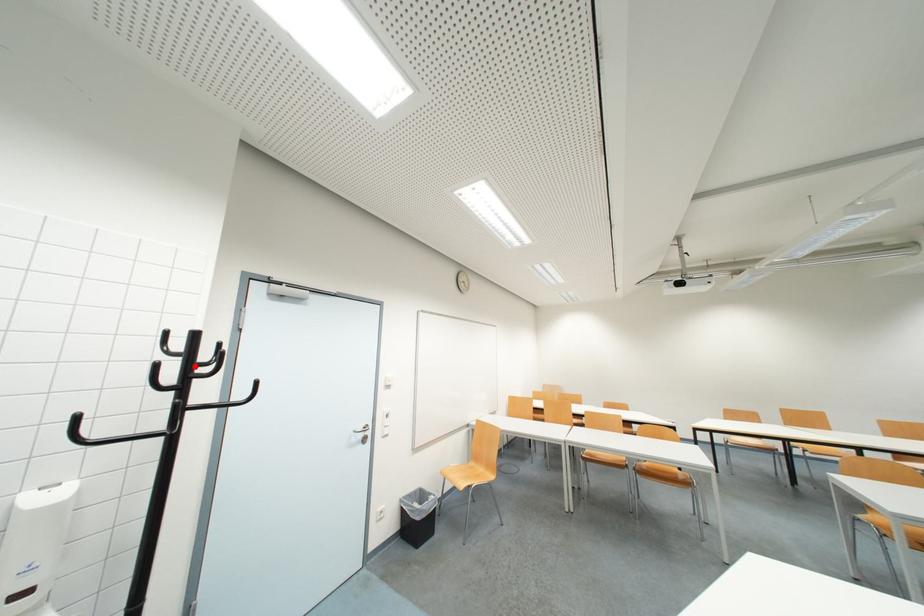
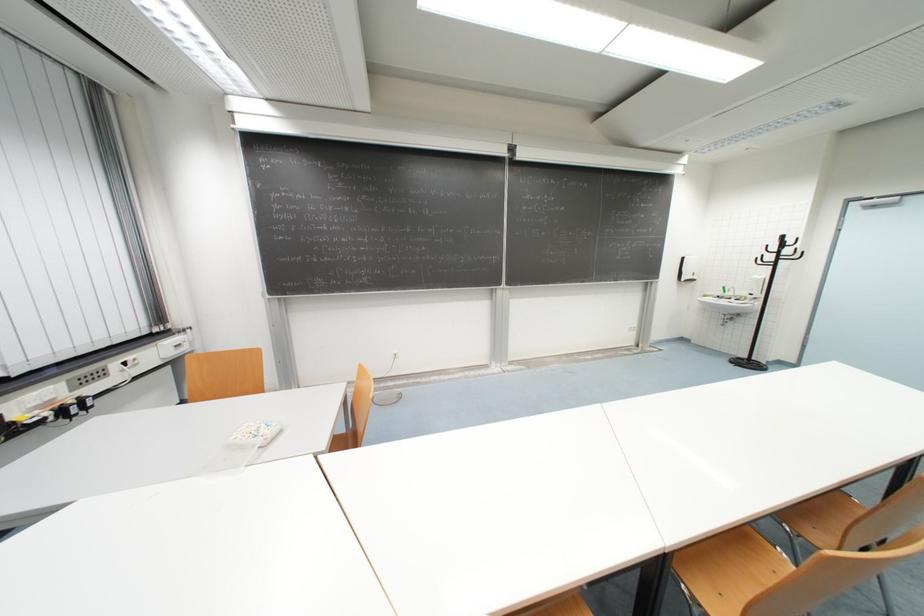
Question: I am providing you with two images of the same scene from different viewpoints. A red point is marked on the first image. At the location where the point appears in image 1, is it still visible in image 2?

Choices:
 (A) Yes
 (B) No

Answer: (A)